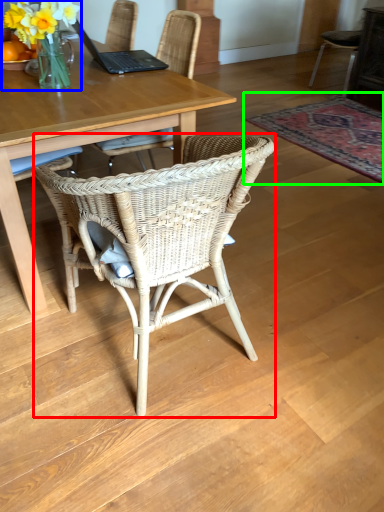
Question: Estimate the real-world distances between objects in this image. Which object is farther from chair (highlighted by a red box), floral arrangement (highlighted by a blue box) or mat (highlighted by a green box)?

Choices:
 (A) floral arrangement
 (B) mat

Answer: (B)